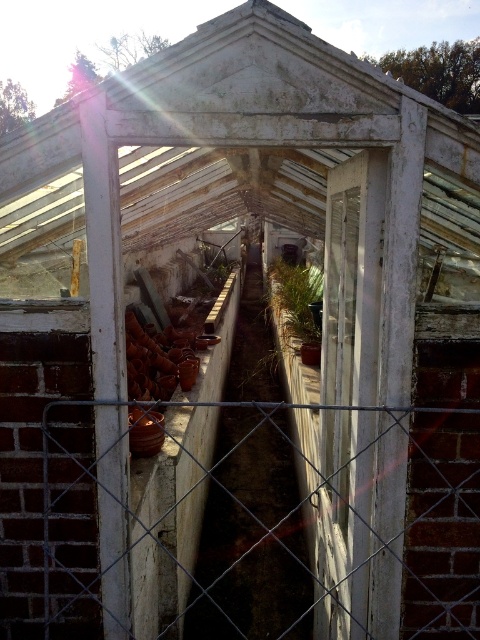
You are a gardener who needs to water both the metal mesh fence at center and the green matte plant at center. Which one is closer to you?

The metal mesh fence at center and green matte plant at center are 8.45 meters apart, so you need to determine which is closer based on their positions. However, the description only provides the distance between them, not their individual distances from you. Without additional information about your starting position, it is impossible to determine which is closer.

You are a gardener who needs to water the green matte plant at center and the metal mesh fence at center. Since the fence is shorter than the plant, which object will require you to bend down more while watering?

The metal mesh fence at center is shorter than the green matte plant at center, so you will need to bend down more to water the metal mesh fence at center.